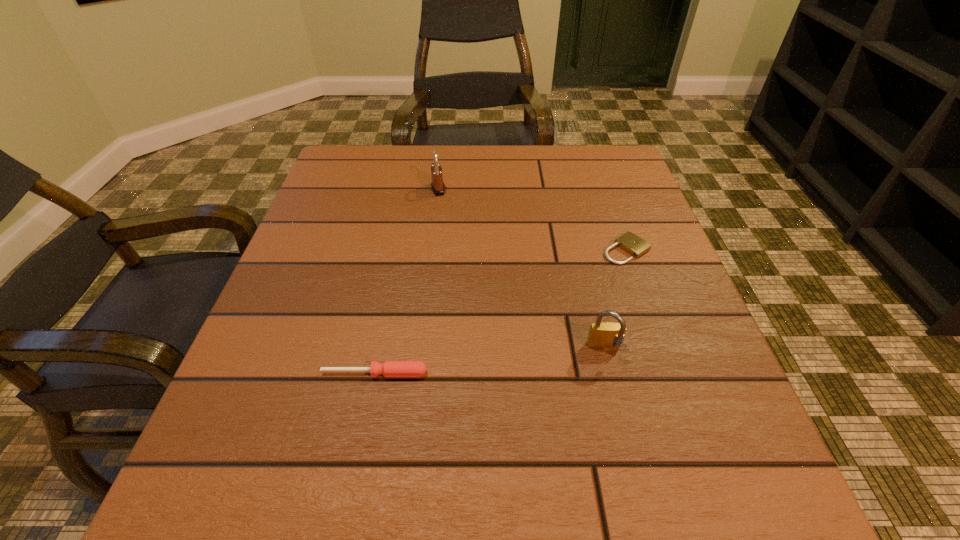
You are a GUI agent. You are given a task and a screenshot of the screen. Output one action in this format:
    pyautogui.click(x=<x>, y=<y>)
    Task: Click on the vacant space that's between the screwdriver and the third object from left to right
    
    Given the screenshot: What is the action you would take?
    490,361

Locate an element on the screen. The image size is (960, 540). vacant region between the farthest object and the rightmost object is located at coordinates (532, 219).

I want to click on unoccupied area between the second shortest object and the nearest padlock, so click(490, 361).

The image size is (960, 540). Find the location of `vacant space in between the second padlock from right to left and the leftmost padlock`. vacant space in between the second padlock from right to left and the leftmost padlock is located at coordinates (521, 269).

Locate an element on the screen. This screenshot has height=540, width=960. free space between the farthest padlock and the rightmost object is located at coordinates (532, 219).

Where is `blank region between the third object from left to right and the nearest object`? The image size is (960, 540). blank region between the third object from left to right and the nearest object is located at coordinates (490, 361).

In order to click on empty location between the third object from left to right and the farthest padlock in this screenshot , I will do `click(521, 269)`.

Locate an element on the screen. free spot between the shortest padlock and the second shortest object is located at coordinates (500, 312).

Where is `free space between the nearest object and the farthest object`? free space between the nearest object and the farthest object is located at coordinates (406, 281).

Locate an element on the screen. The height and width of the screenshot is (540, 960). free point between the nearest padlock and the rightmost object is located at coordinates (615, 299).